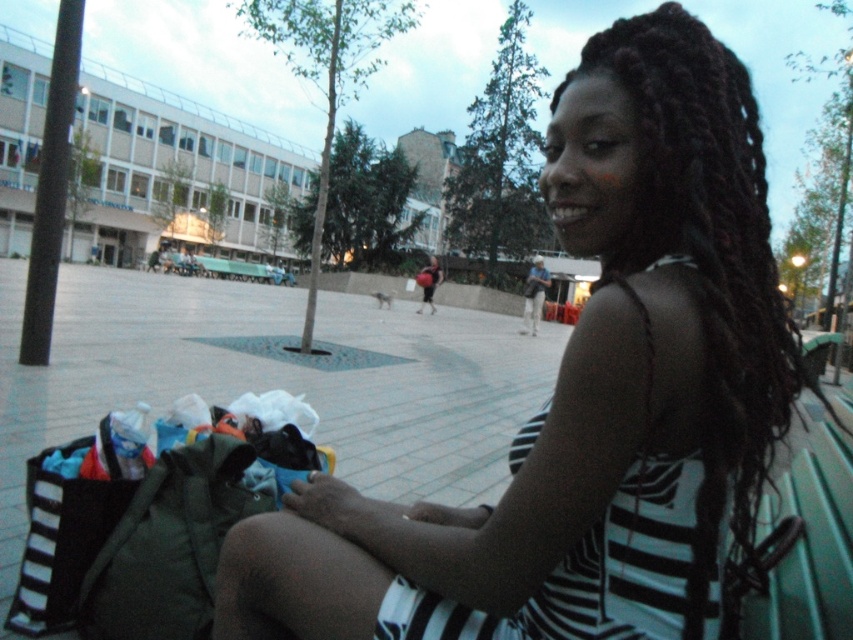
You are a fashion designer observing two black striped dresses in an urban plaza scene. The dresses are labeled as the black striped dress at center and the black striped dress at right. Which dress should you recommend to a client who prefers a more modest, larger size?

The black striped dress at center is bigger than the black striped dress at right, so it would be the better recommendation for a client seeking a more modest, larger size.

You are standing at the point with coordinates point (618, 486) and want to walk to the point with coordinates point (743, 465). Which direction should you move to reach your destination?

To reach point (743, 465) from point (618, 486), you should move backward since point (743, 465) is behind point (618, 486).